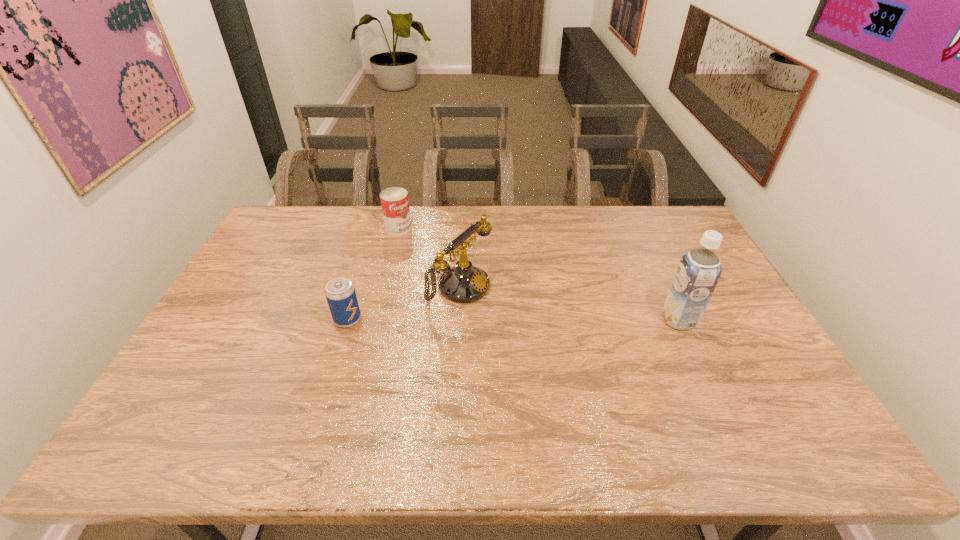
You are a GUI agent. You are given a task and a screenshot of the screen. Output one action in this format:
    pyautogui.click(x=<x>, y=<y>)
    Task: Click on the vacant space situated on the dial of the second object from right to left
    The image size is (960, 540).
    Given the screenshot: What is the action you would take?
    pyautogui.click(x=504, y=310)

Find the location of a particular element. The height and width of the screenshot is (540, 960). free space located 0.130m on the dial of the second object from right to left is located at coordinates (524, 320).

Image resolution: width=960 pixels, height=540 pixels. Find the location of `vacant area situated on the dial of the second object from right to left`. vacant area situated on the dial of the second object from right to left is located at coordinates (507, 312).

Identify the location of vacant space situated 0.190m on the front label of the farthest object. (436, 260).

Where is `vacant space located on the front label of the farthest object`? The height and width of the screenshot is (540, 960). vacant space located on the front label of the farthest object is located at coordinates (425, 252).

Where is `free region located on the front label of the farthest object`? free region located on the front label of the farthest object is located at coordinates (463, 283).

This screenshot has height=540, width=960. Identify the location of object present at the far edge. (394, 201).

This screenshot has height=540, width=960. Identify the location of object situated at the right edge. (699, 270).

Image resolution: width=960 pixels, height=540 pixels. In order to click on free space at the far edge of the desktop in this screenshot , I will do `click(469, 222)`.

This screenshot has width=960, height=540. Find the location of `free location at the near edge of the desktop`. free location at the near edge of the desktop is located at coordinates (457, 406).